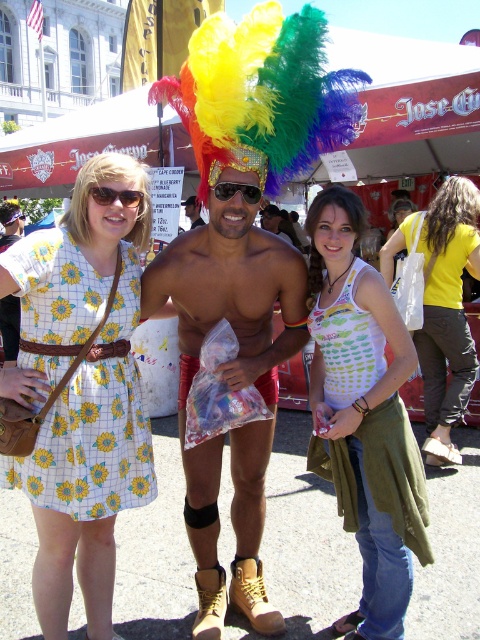
You are a photographer trying to capture the central figure in this festival scene. You notice the white printed tank top at center and the rainbow feather headdress at center. Which item should you focus on to ensure it stands out more due to its size?

The white printed tank top at center is larger in size than the rainbow feather headdress at center, so focusing on the white printed tank top at center would make it stand out more due to its size.

You are a photographer trying to capture the central figure in the scene. You notice the sunglasses at center and the rainbow feather headdress at center. Which object should you focus on to ensure the subject is clearly visible?

The sunglasses at center is in front of the rainbow feather headdress at center, so focusing on the sunglasses at center will ensure the subject is clearly visible.

You are at a festival and want to carry both the white canvas tote bag at center and the sunglasses at center. Which item should you pick up first if you want to carry the larger one first?

The white canvas tote bag at center is bigger than the sunglasses at center, so you should pick up the white canvas tote bag at center first.